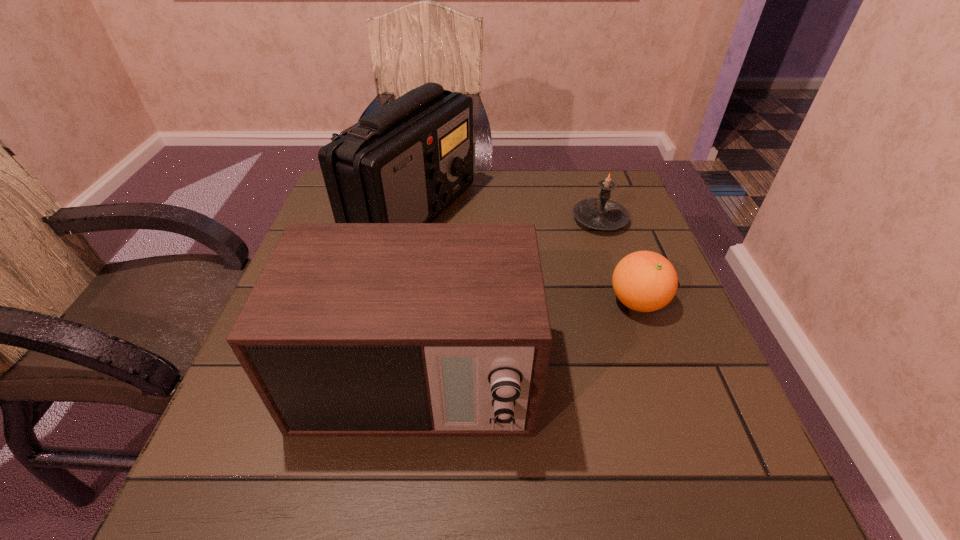
Where is `radio receiver that is at the far edge`? This screenshot has height=540, width=960. radio receiver that is at the far edge is located at coordinates (406, 162).

Find the location of `candle that is at the far edge`. candle that is at the far edge is located at coordinates (601, 213).

Identify the location of candle present at the right edge. This screenshot has height=540, width=960. (601, 213).

Find the location of `orange at the right edge`. orange at the right edge is located at coordinates (645, 281).

Find the location of a particular element. The height and width of the screenshot is (540, 960). object at the far left corner is located at coordinates (406, 162).

The height and width of the screenshot is (540, 960). I want to click on object that is at the far right corner, so click(601, 213).

The height and width of the screenshot is (540, 960). In order to click on free point at the far edge in this screenshot , I will do `click(544, 217)`.

The width and height of the screenshot is (960, 540). In the image, there is a desktop. In order to click on vacant space at the near edge in this screenshot , I will do `click(334, 466)`.

Image resolution: width=960 pixels, height=540 pixels. In the image, there is a desktop. What are the coordinates of `vacant space at the right edge` in the screenshot? It's located at tap(712, 392).

In the image, there is a desktop. In order to click on vacant space at the near left corner in this screenshot , I will do `click(279, 498)`.